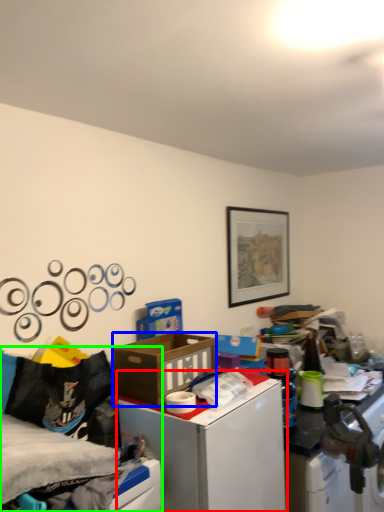
Question: Which is farther away from table (highlighted by a red box)? box (highlighted by a blue box) or bed (highlighted by a green box)?

Choices:
 (A) box
 (B) bed

Answer: (B)